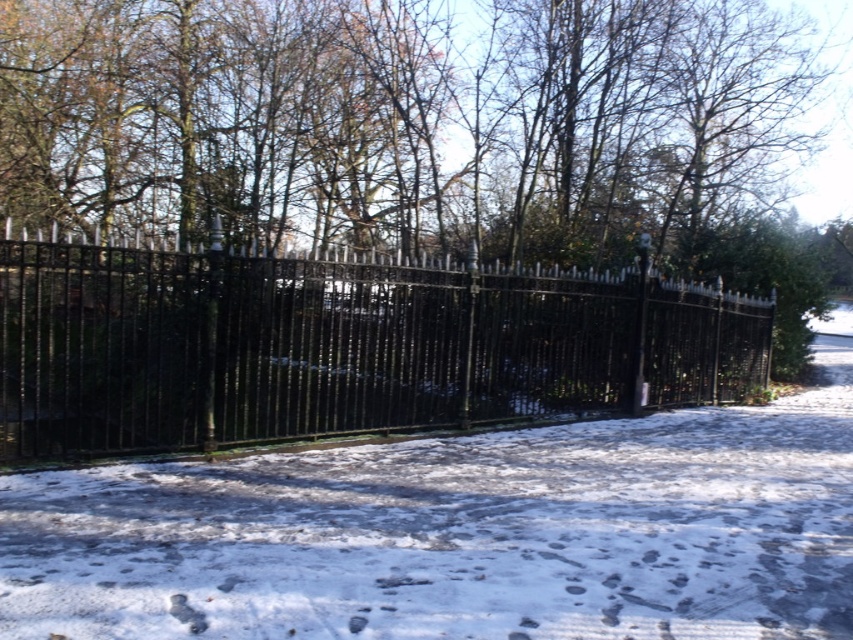
Question: Is white snow at center positioned behind black wrought iron fence at center?

Choices:
 (A) no
 (B) yes

Answer: (A)

Question: Which of the following is the closest to the observer?

Choices:
 (A) (467, 371)
 (B) (563, 460)

Answer: (B)

Question: Is white snow at center positioned at the back of black wrought iron fence at center?

Choices:
 (A) no
 (B) yes

Answer: (A)

Question: Which object appears closest to the camera in this image?

Choices:
 (A) white snow at center
 (B) black wrought iron fence at center

Answer: (A)

Question: Is white snow at center further to camera compared to black wrought iron fence at center?

Choices:
 (A) yes
 (B) no

Answer: (B)